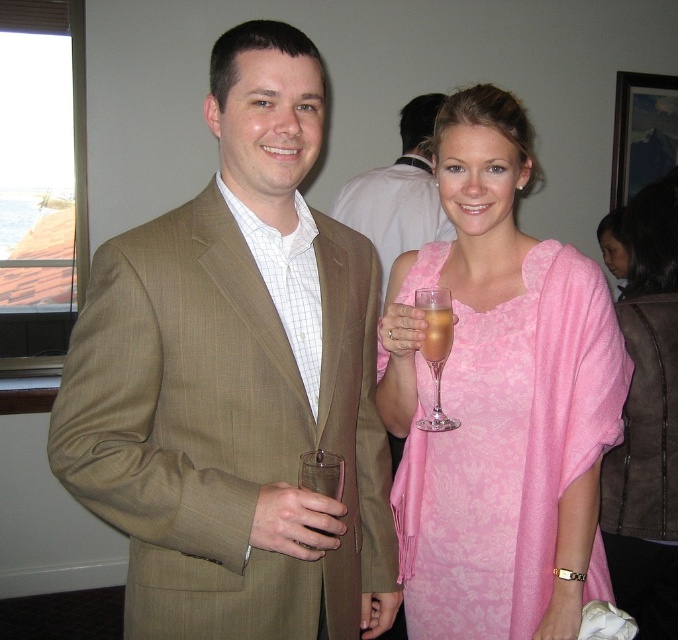
You are standing at the origin of the coordinate system in the room. There are two points marked in the image, point (578, 397) and point (614, 468). Which point is closer to you?

Point (578, 397) is in front of point (614, 468), so it is closer to you.

You are at a party and want to grab a drink from the table. There is a pink suede vest at right and a translucent glass at center. Which object is closer to your right hand if you are facing the table?

The pink suede vest at right is to the right of the translucent glass at center, so if you are facing the table, the pink suede vest at right would be closer to your right hand.

You are a photographer at the event and want to capture a clear photo of the pink damask fabric dress at center without the pink suede vest at right blocking it. Is this possible given their positions?

The pink damask fabric dress at center is in front of the pink suede vest at right, so it is possible to capture a clear photo of the pink damask fabric dress at center without the pink suede vest at right blocking it since the dress is positioned in front.